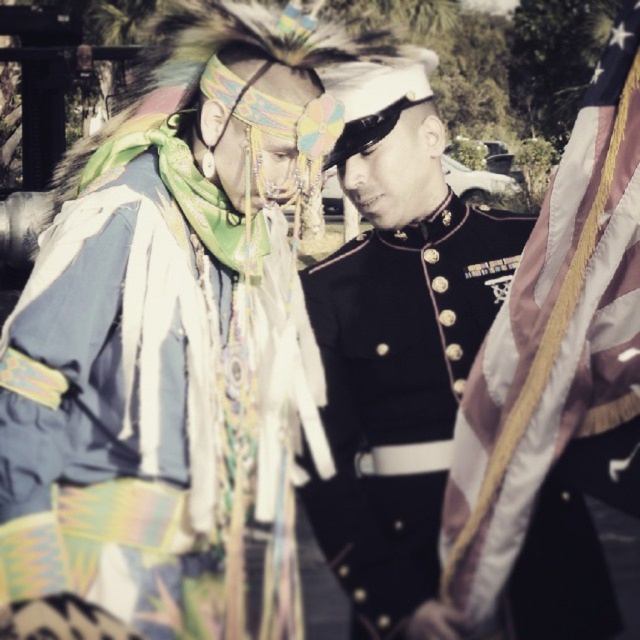
Is textured fabric headdress at upper left shorter than silky satin flag at right?

No.

Is point (150, 406) farther from viewer compared to point (518, 412)?

That is True.

Where is `textured fabric headdress at upper left`? The height and width of the screenshot is (640, 640). textured fabric headdress at upper left is located at coordinates (173, 340).

Does black polished uniform at center have a lesser height compared to silky satin flag at right?

Correct, black polished uniform at center is not as tall as silky satin flag at right.

Is black polished uniform at center to the right of silky satin flag at right from the viewer's perspective?

No, black polished uniform at center is not to the right of silky satin flag at right.

The width and height of the screenshot is (640, 640). What do you see at coordinates (397, 392) in the screenshot?
I see `black polished uniform at center` at bounding box center [397, 392].

Find the location of a particular element. The height and width of the screenshot is (640, 640). black polished uniform at center is located at coordinates (397, 392).

Is textured fabric headdress at upper left taller than black polished uniform at center?

Indeed, textured fabric headdress at upper left has a greater height compared to black polished uniform at center.

What do you see at coordinates (173, 340) in the screenshot?
I see `textured fabric headdress at upper left` at bounding box center [173, 340].

This screenshot has width=640, height=640. Find the location of `textured fabric headdress at upper left`. textured fabric headdress at upper left is located at coordinates (173, 340).